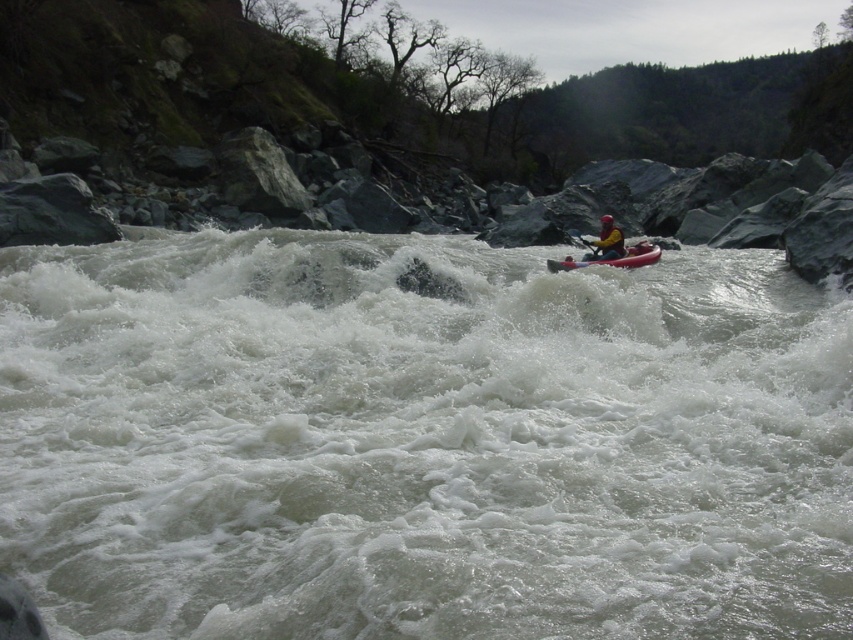
You are a kayaker observing the scene. You see the white frothy water at center and the yellow fabric kayak at center. Which object is positioned lower in the image?

The white frothy water at center is located below the yellow fabric kayak at center, so it is positioned lower in the image.

You are a kayaker preparing to navigate the rapids shown in the image. You notice the white frothy water at center and the rubber kayak at center. Based on their sizes, which one is taller?

The white frothy water at center is taller than the rubber kayak at center, so the white frothy water at center is taller.

You are a kayaker observing the white frothy water at center and the yellow fabric kayak at center in the river. Which object is wider?

The white frothy water at center is wider than the yellow fabric kayak at center.